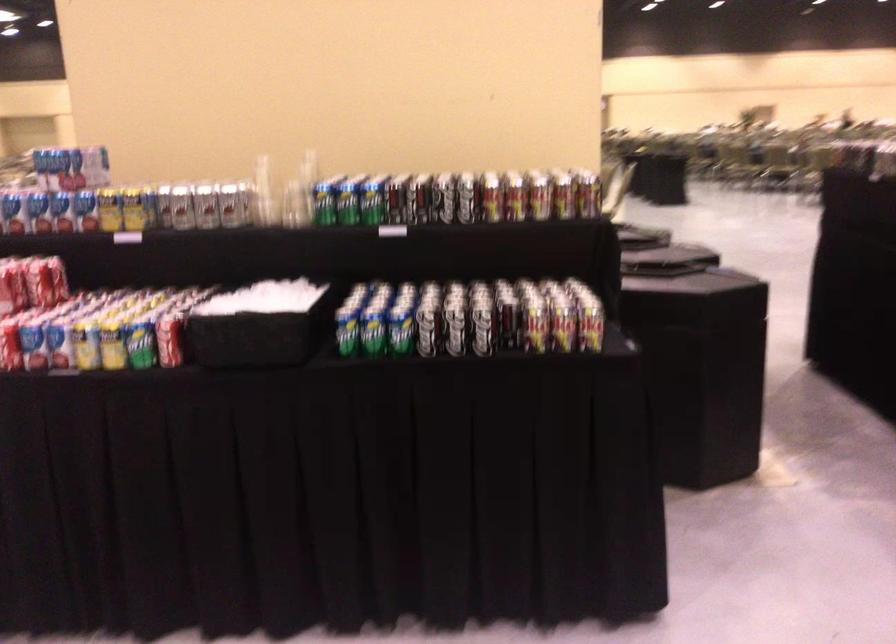
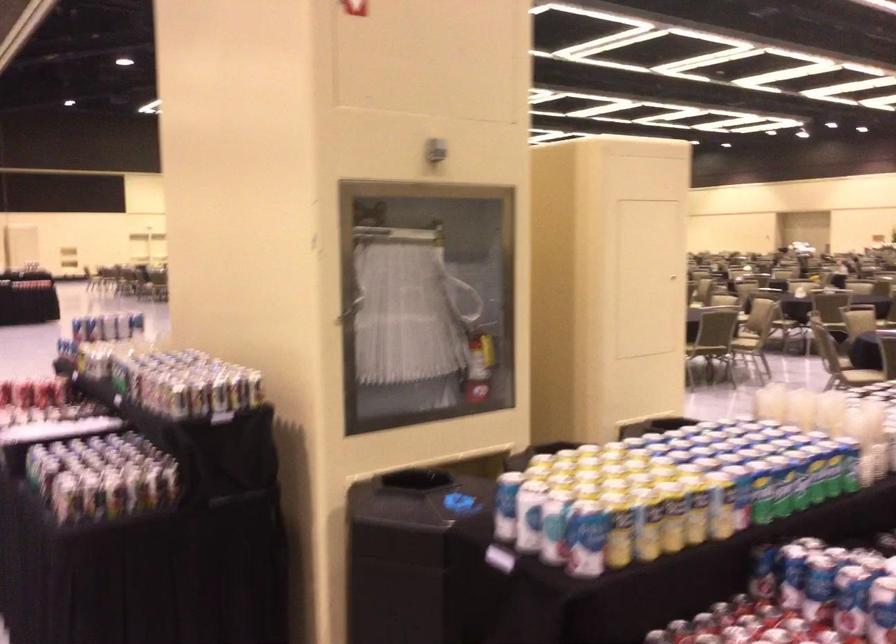
In the second image, find the point that corresponds to point 576,84 in the first image.

(349, 310)